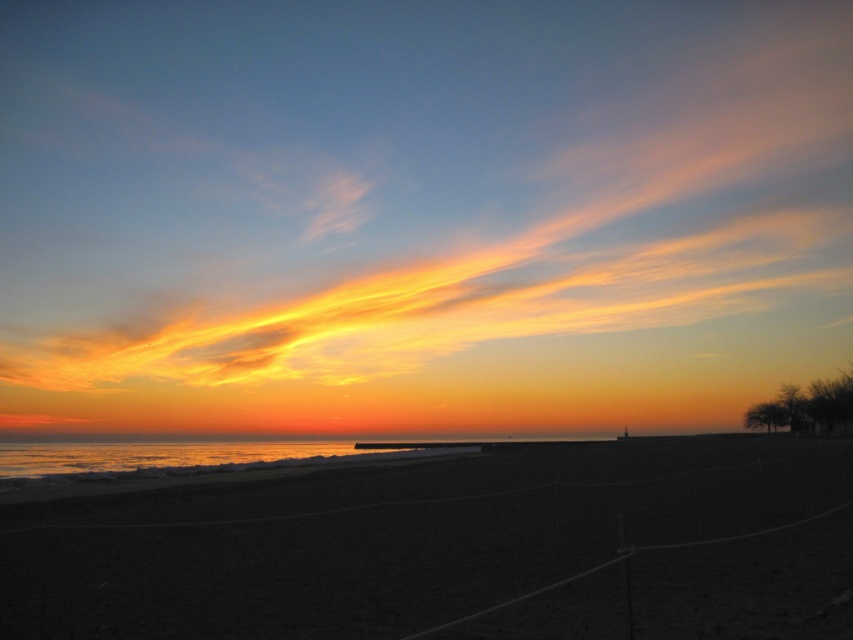
Which is below, golden translucent clouds at upper center or dark sand at center?

Positioned lower is dark sand at center.

Is golden translucent clouds at upper center thinner than dark sand at center?

No.

Who is more forward, (314, 256) or (15, 556)?

Point (15, 556) is more forward.

Where is `golden translucent clouds at upper center`? This screenshot has height=640, width=853. golden translucent clouds at upper center is located at coordinates (419, 214).